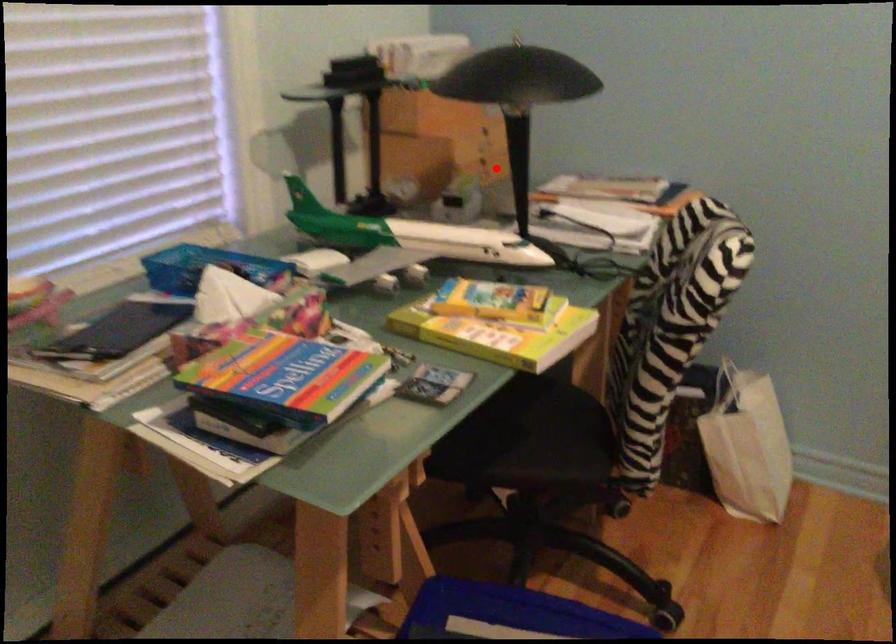
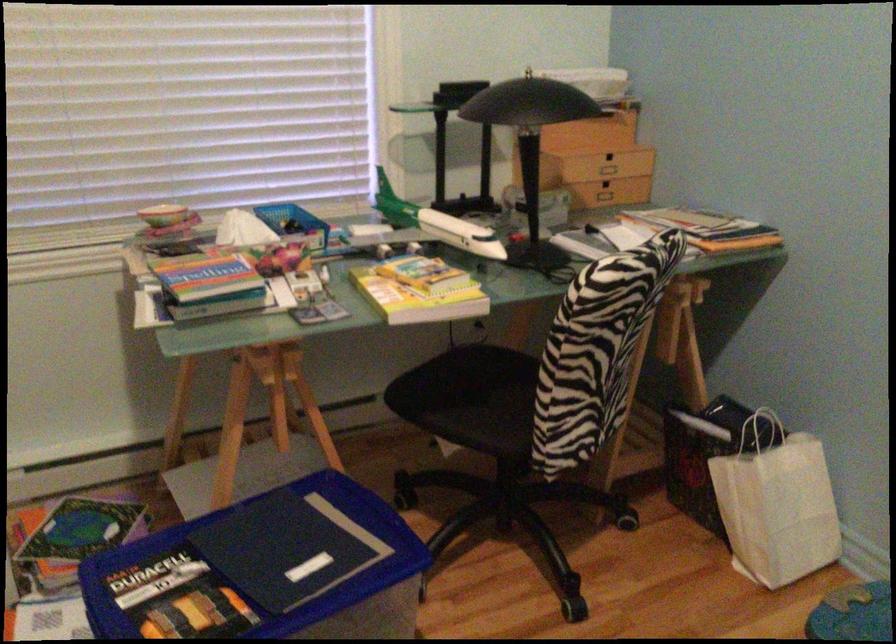
Locate, in the second image, the point that corresponds to the highlighted location in the first image.

(616, 191)